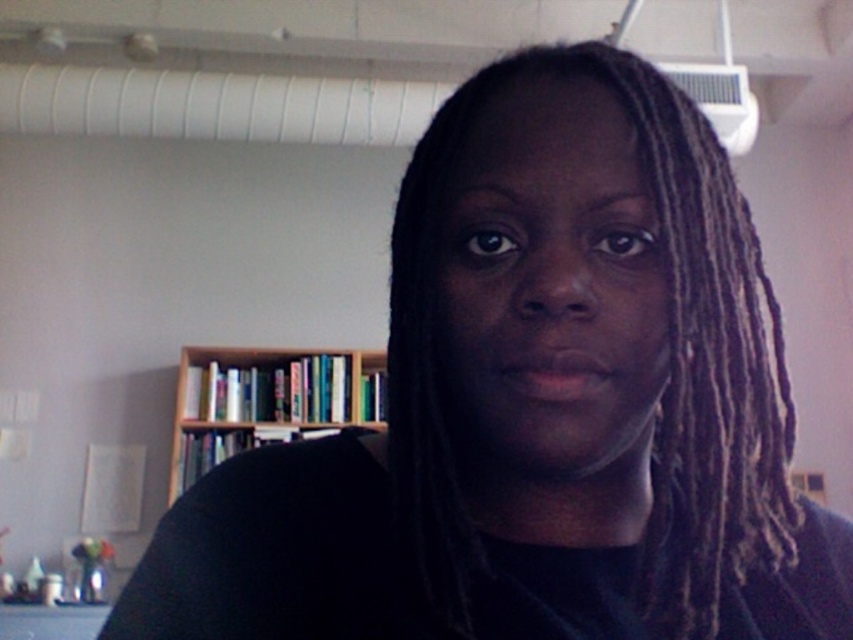
Is point (404, 275) behind point (360, 372)?

No.

Between brown/dry/dreadlocks at center and wooden bookshelf at center, which one has less height?

With less height is brown/dry/dreadlocks at center.

In order to click on brown/dry/dreadlocks at center in this screenshot , I will do `click(670, 360)`.